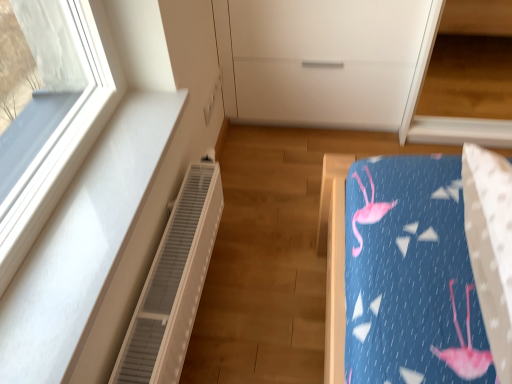
Question: Is white plastic radiator at left to the left or to the right of white matte dresser at upper center in the image?

Choices:
 (A) right
 (B) left

Answer: (B)

Question: From the image's perspective, relative to white matte dresser at upper center, is white plastic radiator at left above or below?

Choices:
 (A) above
 (B) below

Answer: (B)

Question: Based on their sizes in the image, would you say white plastic radiator at left is bigger or smaller than white matte dresser at upper center?

Choices:
 (A) small
 (B) big

Answer: (A)

Question: From a real-world perspective, is white matte dresser at upper center above or below white plastic radiator at left?

Choices:
 (A) above
 (B) below

Answer: (A)

Question: Considering the positions of white matte dresser at upper center and white plastic radiator at left in the image, is white matte dresser at upper center taller or shorter than white plastic radiator at left?

Choices:
 (A) short
 (B) tall

Answer: (B)

Question: Based on their positions, is white matte dresser at upper center located to the left or right of white plastic radiator at left?

Choices:
 (A) left
 (B) right

Answer: (B)

Question: Is white matte dresser at upper center in front of or behind white plastic radiator at left in the image?

Choices:
 (A) front
 (B) behind

Answer: (B)